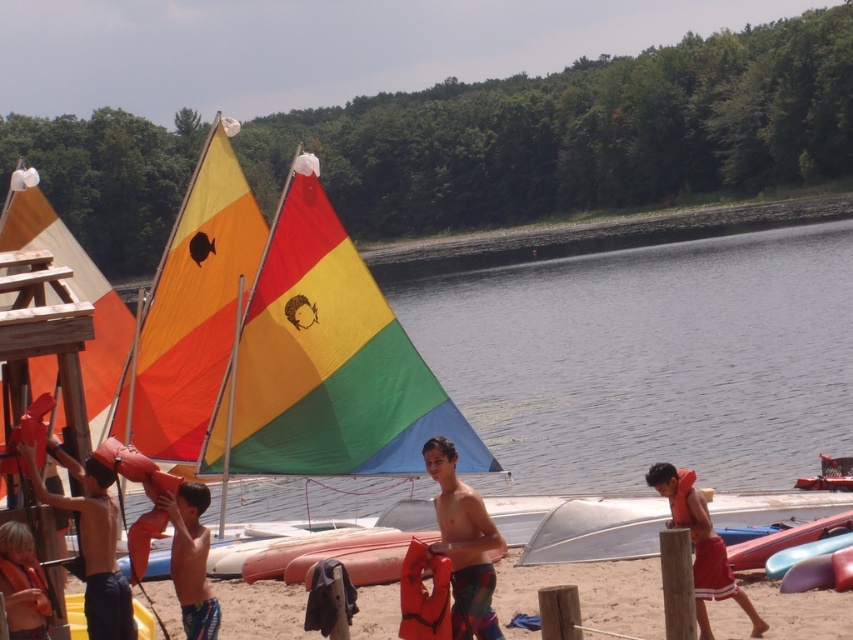
Question: Which object is closer to the camera taking this photo?

Choices:
 (A) orange life jackets at center
 (B) orange life vest at center
 (C) orange matte life jacket at right

Answer: (B)

Question: Which object is farther from the camera taking this photo?

Choices:
 (A) orange life jacket at lower left
 (B) orange life jackets at center

Answer: (B)

Question: Does orange life vest at left have a larger size compared to red life vest at right?

Choices:
 (A) no
 (B) yes

Answer: (B)

Question: Which of the following is the farthest from the observer?

Choices:
 (A) orange life vest at center
 (B) orange matte life jacket at right
 (C) orange life preserver at center
 (D) orange matte life jacket at center

Answer: (B)

Question: Considering the relative positions of orange life jackets at center and orange life vest at center in the image provided, where is orange life jackets at center located with respect to orange life vest at center?

Choices:
 (A) above
 (B) below

Answer: (B)

Question: Where is orange life preserver at center located in relation to orange life vest at left in the image?

Choices:
 (A) left
 (B) right

Answer: (B)